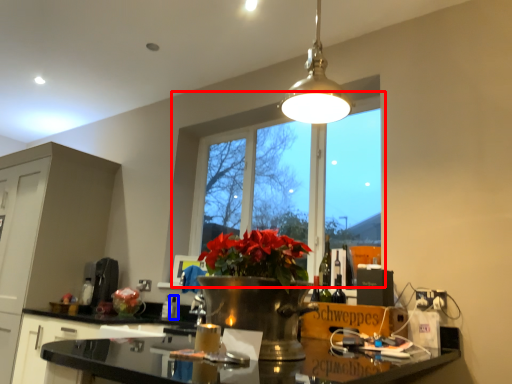
Question: Which point is closer to the camera, window (highlighted by a red box) or bottle (highlighted by a blue box)?

Choices:
 (A) window
 (B) bottle

Answer: (A)